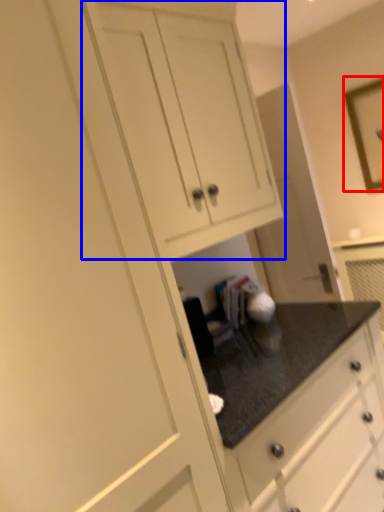
Question: Which of the following is the closest to the observer, picture frame (highlighted by a red box) or cabinetry (highlighted by a blue box)?

Choices:
 (A) picture frame
 (B) cabinetry

Answer: (B)